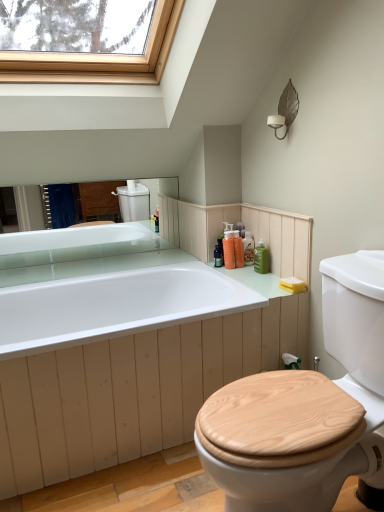
The image size is (384, 512). Find the location of `vacant space to the left of green plastic bottles at upper right, which ranks as the first toiletry in right-to-left order`. vacant space to the left of green plastic bottles at upper right, which ranks as the first toiletry in right-to-left order is located at coordinates (243, 268).